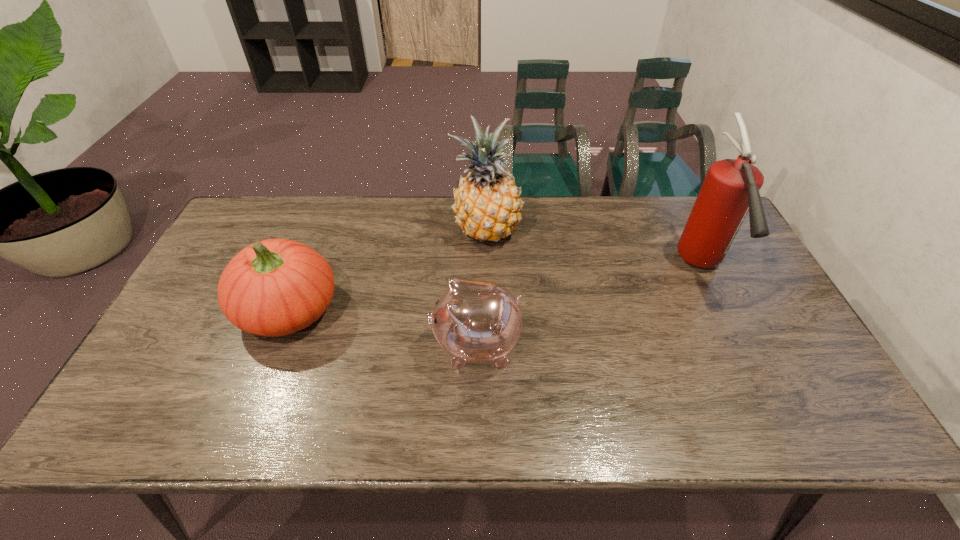
Image resolution: width=960 pixels, height=540 pixels. Identify the location of free point located on the front facing side of the piggy bank. (281, 345).

The width and height of the screenshot is (960, 540). I want to click on fire extinguisher present at the far edge, so click(x=730, y=190).

You are a GUI agent. You are given a task and a screenshot of the screen. Output one action in this format:
    pyautogui.click(x=<x>, y=<y>)
    Task: Click on the pineapple located in the far edge section of the desktop
    The height and width of the screenshot is (540, 960).
    Given the screenshot: What is the action you would take?
    pyautogui.click(x=487, y=204)

Identify the location of object that is at the left edge. The height and width of the screenshot is (540, 960). (276, 287).

Locate an element on the screen. The height and width of the screenshot is (540, 960). object positioned at the right edge is located at coordinates (730, 190).

Where is `object present at the far right corner`? This screenshot has width=960, height=540. object present at the far right corner is located at coordinates (730, 190).

At what (x,y) coordinates should I click in order to perform the action: click on vacant space at the far edge of the desktop. Please return your answer as a coordinate pair (x, y). Image resolution: width=960 pixels, height=540 pixels. Looking at the image, I should click on (281, 230).

Where is `vacant position at the near edge of the desktop`? This screenshot has height=540, width=960. vacant position at the near edge of the desktop is located at coordinates (750, 438).

What are the coordinates of `free space at the right edge` in the screenshot? It's located at (802, 360).

This screenshot has height=540, width=960. In the image, there is a desktop. In order to click on free space at the far left corner in this screenshot , I will do `click(287, 209)`.